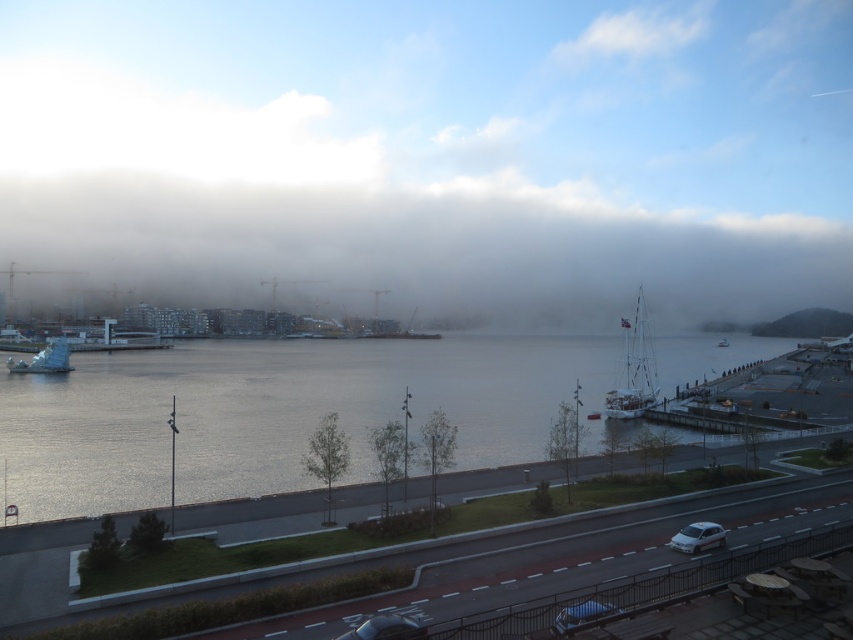
Question: Which point appears closest to the camera in this image?

Choices:
 (A) (50, 401)
 (B) (759, 13)
 (C) (67, 368)

Answer: (A)

Question: Which of the following is the closest to the observer?

Choices:
 (A) (714, 524)
 (B) (589, 625)

Answer: (B)

Question: Estimate the real-world distances between objects in this image. Which object is closer to the white matte sailboat at right?

Choices:
 (A) white matte sculpture at lower left
 (B) white fluffy fog at center
 (C) blue matte car at lower center
 (D) white glossy car at lower right

Answer: (D)

Question: Is white fluffy fog at center smaller than white matte sailboat at right?

Choices:
 (A) yes
 (B) no

Answer: (B)

Question: Does white matte sailboat at right have a larger size compared to metallic silver car at lower center?

Choices:
 (A) yes
 (B) no

Answer: (A)

Question: Does glistening water at center lie in front of blue matte car at lower center?

Choices:
 (A) yes
 (B) no

Answer: (B)